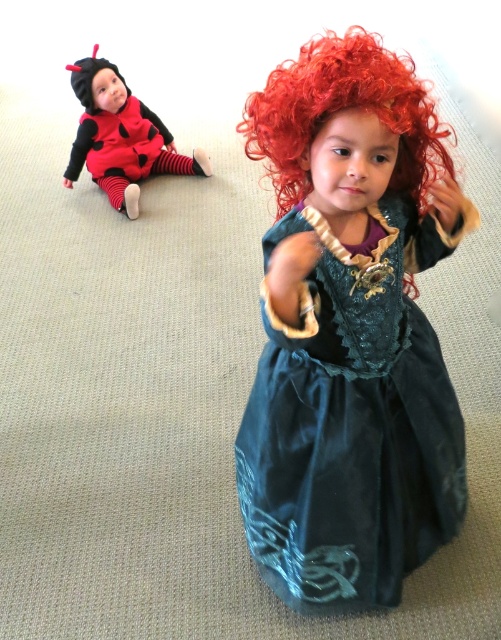
Does curly red wig at center have a lesser height compared to matte black and red costume at upper left?

Yes, curly red wig at center is shorter than matte black and red costume at upper left.

Is curly red wig at center below matte black and red costume at upper left?

Yes, curly red wig at center is below matte black and red costume at upper left.

Which is in front, point (392, 115) or point (117, 115)?

Point (392, 115)

This screenshot has width=501, height=640. What are the coordinates of `curly red wig at center` in the screenshot? It's located at (344, 109).

Is teal velvet dress at center positioned before curly red wig at center?

Yes.

Can you confirm if teal velvet dress at center is thinner than curly red wig at center?

Correct, teal velvet dress at center's width is less than curly red wig at center's.

Is point (347, 273) positioned before point (266, 128)?

No, it is not.

This screenshot has width=501, height=640. Find the location of `teal velvet dress at center`. teal velvet dress at center is located at coordinates (353, 420).

What are the coordinates of `teal velvet dress at center` in the screenshot? It's located at (353, 420).

Does teal velvet dress at center come behind matte black and red costume at upper left?

No, teal velvet dress at center is closer to the viewer.

Find the location of a particular element. teal velvet dress at center is located at coordinates (353, 420).